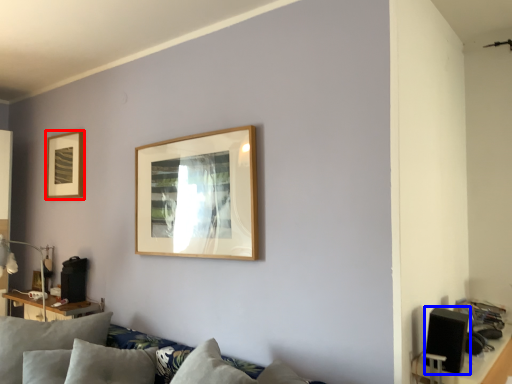
Question: Which object is closer to the camera taking this photo, picture frame (highlighted by a red box) or speaker (highlighted by a blue box)?

Choices:
 (A) picture frame
 (B) speaker

Answer: (B)